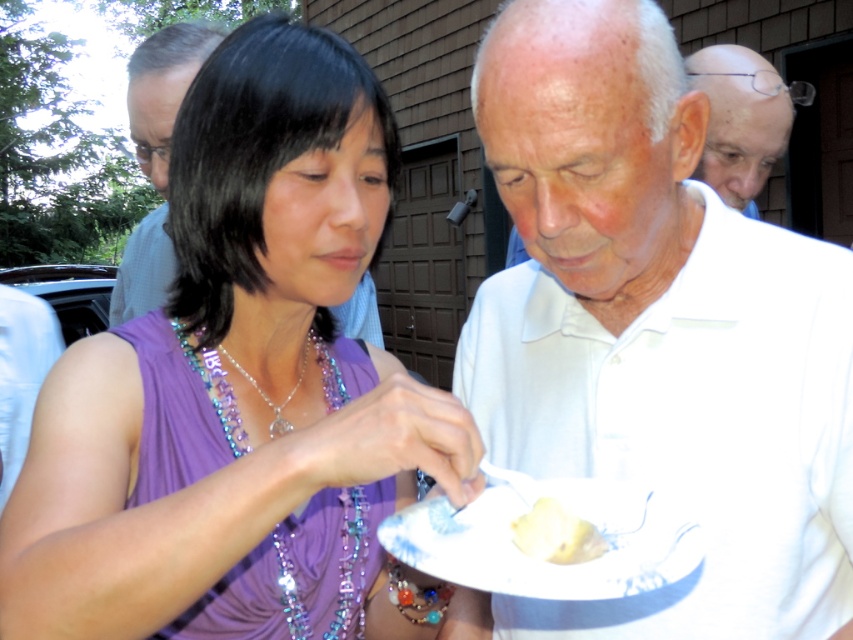
Question: Which of the following is the farthest from the observer?

Choices:
 (A) (289, 429)
 (B) (786, 116)
 (C) (579, 560)
 (D) (223, 316)

Answer: (B)

Question: Does white matte shirt at center have a smaller size compared to gray fabric shirt at upper left?

Choices:
 (A) no
 (B) yes

Answer: (B)

Question: Is the position of white porcelain plate at center less distant than that of shiny plastic beads at center?

Choices:
 (A) no
 (B) yes

Answer: (B)

Question: Which object is closer to the camera taking this photo?

Choices:
 (A) white smooth shirt at center
 (B) yellow matte paper at lower center
 (C) bald head at upper right

Answer: (B)

Question: Can you confirm if purple fabric dress at center is positioned to the right of bald head at upper right?

Choices:
 (A) yes
 (B) no

Answer: (B)

Question: Among these points, which one is farthest from the camera?

Choices:
 (A) (759, 144)
 (B) (297, 129)
 (C) (735, 106)
 (D) (305, 358)

Answer: (A)